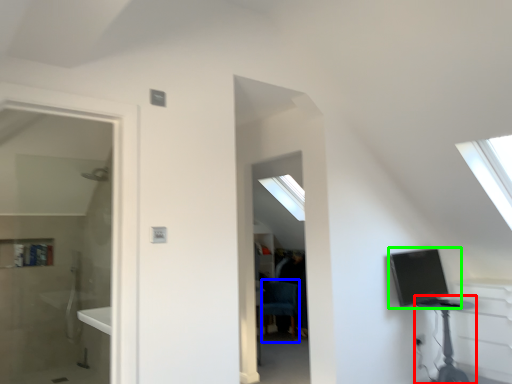
Question: Based on their relative distances, which object is nearer to table (highlighted by a red box)? Choose from swivel chair (highlighted by a blue box) and computer (highlighted by a green box).

Choices:
 (A) swivel chair
 (B) computer

Answer: (B)